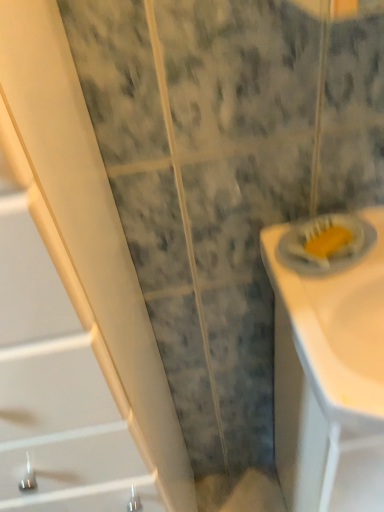
What is the approximate width of white glossy sink at right?

The width of white glossy sink at right is 15.39 inches.

This screenshot has height=512, width=384. Describe the element at coordinates (329, 379) in the screenshot. I see `white glossy sink at right` at that location.

You are a GUI agent. You are given a task and a screenshot of the screen. Output one action in this format:
    pyautogui.click(x=<x>, y=<y>)
    Task: Click on the white glossy sink at right
    The width and height of the screenshot is (384, 512).
    Given the screenshot: What is the action you would take?
    pyautogui.click(x=329, y=379)

Image resolution: width=384 pixels, height=512 pixels. What are the coordinates of `white glossy sink at right` in the screenshot? It's located at (329, 379).